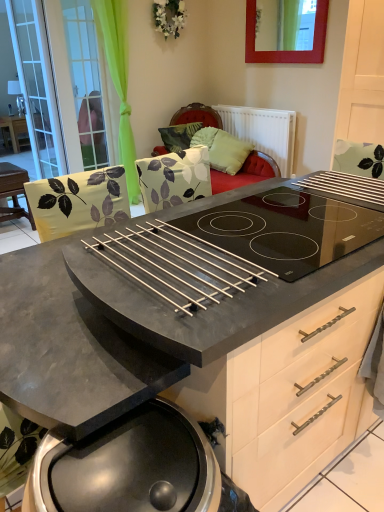
In order to click on matte black table at left, the first table from the back in this screenshot , I will do `click(14, 130)`.

In order to face metallic matte barbecue grill at lower center, should I rotate leftwards or rightwards?

Turn left approximately 5.313 degrees to face it.

The height and width of the screenshot is (512, 384). I want to click on green leaf-patterned pillow at upper center, the second pillow in the right-to-left sequence, so click(x=179, y=136).

Describe the element at coordinates (179, 136) in the screenshot. This screenshot has width=384, height=512. I see `green leaf-patterned pillow at upper center, which is counted as the 1th pillow, starting from the left` at that location.

How much space does green fabric screen door at upper left, the second screen door in the left-to-right sequence, occupy horizontally?

green fabric screen door at upper left, the second screen door in the left-to-right sequence, is 3.84 inches wide.

Measure the distance between red wood picture frame at upper center and camera.

The distance of red wood picture frame at upper center from camera is 3.37 meters.

Find the location of a particular element. This screenshot has width=384, height=512. white matte radiator at upper center is located at coordinates (263, 131).

Where is `matte black table at left, which is the first table in right-to-left order`? The image size is (384, 512). matte black table at left, which is the first table in right-to-left order is located at coordinates (14, 192).

Locate an element on the screen. green fabric pillow at center, positioned as the 1th pillow in right-to-left order is located at coordinates (228, 152).

You are a GUI agent. You are given a task and a screenshot of the screen. Output one action in this format:
    pyautogui.click(x=<x>, y=<y>)
    Task: Click on the matte black table at left, which is counted as the second table, starting from the right
    This screenshot has height=512, width=384.
    Given the screenshot: What is the action you would take?
    pyautogui.click(x=14, y=130)

Is matte black table at left, which is the first table in right-to-left order, inside or outside of white matte radiator at upper center?

matte black table at left, which is the first table in right-to-left order, is outside white matte radiator at upper center.

Between matte black table at left, the 2th table from the left, and white matte radiator at upper center, which one appears on the left side from the viewer's perspective?

matte black table at left, the 2th table from the left, is more to the left.

Locate an element on the screen. This screenshot has height=512, width=384. radiator on the right of matte black table at left, marked as the 2th table in a back-to-front arrangement is located at coordinates (263, 131).

From the image's perspective, is matte black table at left, the 1th table viewed from the front, under white matte radiator at upper center?

Yes, from the image's perspective, matte black table at left, the 1th table viewed from the front, is beneath white matte radiator at upper center.

Which of these two, green fabric screen door at upper left, the second screen door in the left-to-right sequence, or transparent glass screen door at left, which is the second screen door in right-to-left order, is bigger?

Bigger between the two is transparent glass screen door at left, which is the second screen door in right-to-left order.

From the image's perspective, which is below, green fabric screen door at upper left, which is counted as the 1th screen door, starting from the right, or transparent glass screen door at left, placed as the 1th screen door when sorted from left to right?

From the image's view, transparent glass screen door at left, placed as the 1th screen door when sorted from left to right, is below.

Does point (96, 146) lie in front of point (26, 60)?

That is False.

Would you say green fabric screen door at upper left, the second screen door in the left-to-right sequence, is inside or outside transparent glass screen door at left, placed as the 1th screen door when sorted from left to right?

green fabric screen door at upper left, the second screen door in the left-to-right sequence, is not enclosed by transparent glass screen door at left, placed as the 1th screen door when sorted from left to right.

From the image's perspective, between transparent glass screen door at left, which is the second screen door in right-to-left order, and matte black table at left, which is the first table in right-to-left order, who is located below?

matte black table at left, which is the first table in right-to-left order.

From the matte black table at left, which is the first table in right-to-left order, count 1st screen door to the right and point to it. Please provide its 2D coordinates.

[(37, 85)]

Considering the sizes of objects transparent glass screen door at left, placed as the 1th screen door when sorted from left to right, and matte black table at left, the 1th table viewed from the front, in the image provided, who is shorter, transparent glass screen door at left, placed as the 1th screen door when sorted from left to right, or matte black table at left, the 1th table viewed from the front,?

Standing shorter between the two is matte black table at left, the 1th table viewed from the front.

This screenshot has height=512, width=384. What are the coordinates of `screen door that is the 1st object to the left of the red wood picture frame at upper center, starting at the anchor` in the screenshot? It's located at (81, 81).

Can we say red wood picture frame at upper center lies outside green fabric screen door at upper left, which is counted as the 1th screen door, starting from the right?

That's correct, red wood picture frame at upper center is outside of green fabric screen door at upper left, which is counted as the 1th screen door, starting from the right.

Would you say red wood picture frame at upper center is a long distance from green fabric screen door at upper left, which is counted as the 1th screen door, starting from the right?

red wood picture frame at upper center is positioned a significant distance from green fabric screen door at upper left, which is counted as the 1th screen door, starting from the right.

In the scene shown: Between red wood picture frame at upper center and green fabric screen door at upper left, which is counted as the 1th screen door, starting from the right, which one is positioned in front?

red wood picture frame at upper center is closer to the camera.

From the picture: Is transparent glass screen door at left, which is the second screen door in right-to-left order, facing away from green leaf-patterned pillow at upper center, which is counted as the 1th pillow, starting from the left?

No, transparent glass screen door at left, which is the second screen door in right-to-left order,'s orientation is not away from green leaf-patterned pillow at upper center, which is counted as the 1th pillow, starting from the left.

Is green leaf-patterned pillow at upper center, which is counted as the 1th pillow, starting from the left, inside transparent glass screen door at left, placed as the 1th screen door when sorted from left to right?

No.

Does transparent glass screen door at left, placed as the 1th screen door when sorted from left to right, touch green leaf-patterned pillow at upper center, which is counted as the 1th pillow, starting from the left?

transparent glass screen door at left, placed as the 1th screen door when sorted from left to right, and green leaf-patterned pillow at upper center, which is counted as the 1th pillow, starting from the left, are clearly separated.

How many degrees apart are the facing directions of transparent glass screen door at left, placed as the 1th screen door when sorted from left to right, and green leaf-patterned pillow at upper center, the second pillow in the right-to-left sequence?

transparent glass screen door at left, placed as the 1th screen door when sorted from left to right, and green leaf-patterned pillow at upper center, the second pillow in the right-to-left sequence, are facing 73.7 degrees away from each other.

From the image's perspective, between metallic matte barbecue grill at lower center and matte black table at left, which is the 1th table in bottom-to-top order, who is located below?

From the image's view, metallic matte barbecue grill at lower center is below.

Considering the relative sizes of metallic matte barbecue grill at lower center and matte black table at left, which is the 1th table in bottom-to-top order, in the image provided, is metallic matte barbecue grill at lower center smaller than matte black table at left, which is the 1th table in bottom-to-top order,?

Indeed, metallic matte barbecue grill at lower center has a smaller size compared to matte black table at left, which is the 1th table in bottom-to-top order.

Consider the image. Is metallic matte barbecue grill at lower center looking in the opposite direction of matte black table at left, the 2th table from the left?

Yes, metallic matte barbecue grill at lower center is facing away from matte black table at left, the 2th table from the left.

Do you think metallic matte barbecue grill at lower center is within matte black table at left, the 1th table viewed from the front, or outside of it?

metallic matte barbecue grill at lower center is not enclosed by matte black table at left, the 1th table viewed from the front.

From the image's perspective, relative to matte black table at left, marked as the 2th table in a back-to-front arrangement, is green fabric screen door at upper left, the second screen door in the left-to-right sequence, above or below?

From the image's perspective, green fabric screen door at upper left, the second screen door in the left-to-right sequence, appears above matte black table at left, marked as the 2th table in a back-to-front arrangement.

Is green fabric screen door at upper left, the second screen door in the left-to-right sequence, wider or thinner than matte black table at left, the second table in the top-to-bottom sequence?

Considering their sizes, green fabric screen door at upper left, the second screen door in the left-to-right sequence, looks slimmer than matte black table at left, the second table in the top-to-bottom sequence.

Locate an element on the screen. the 1st table to the left when counting from the green fabric screen door at upper left, the second screen door in the left-to-right sequence is located at coordinates (14, 192).

From a real-world perspective, between green fabric screen door at upper left, the second screen door in the left-to-right sequence, and matte black table at left, the 2th table from the left, who is vertically lower?

From a 3D spatial view, matte black table at left, the 2th table from the left, is below.

Identify the location of the 1st table counting from the left of the white matte radiator at upper center. This screenshot has width=384, height=512. point(14,192).

Locate an element on the screen. screen door lying above the transparent glass screen door at left, which is the second screen door in right-to-left order (from the image's perspective) is located at coordinates (81, 81).

Estimate the real-world distances between objects in this image. Which object is further from transparent glass screen door at left, which is the second screen door in right-to-left order, metallic matte barbecue grill at lower center or matte black table at left, the first table from the back?

metallic matte barbecue grill at lower center is further to transparent glass screen door at left, which is the second screen door in right-to-left order.

Consider the image. Which object lies further to the anchor point matte black table at left, acting as the second table starting from the front, green fabric screen door at upper left, which is counted as the 1th screen door, starting from the right, or green fabric pillow at center, the 2th pillow viewed from the left?

green fabric pillow at center, the 2th pillow viewed from the left.

Considering their positions, is green fabric screen door at upper left, the second screen door in the left-to-right sequence, positioned closer to red wood picture frame at upper center than white matte radiator at upper center?

white matte radiator at upper center is closer to red wood picture frame at upper center.

Considering their positions, is matte black table at left, the 2th table from the left, positioned closer to transparent glass screen door at left, which is the second screen door in right-to-left order, than green fabric screen door at upper left, which is counted as the 1th screen door, starting from the right?

green fabric screen door at upper left, which is counted as the 1th screen door, starting from the right.

Considering their positions, is matte black table at left, the 2th table from the left, positioned closer to green fabric screen door at upper left, the second screen door in the left-to-right sequence, than transparent glass screen door at left, which is the second screen door in right-to-left order?

transparent glass screen door at left, which is the second screen door in right-to-left order, is closer to green fabric screen door at upper left, the second screen door in the left-to-right sequence.

When comparing their distances from green fabric screen door at upper left, which is counted as the 1th screen door, starting from the right, does transparent glass screen door at left, placed as the 1th screen door when sorted from left to right, or matte black table at left, the 2th table from the left, seem further?

The object further to green fabric screen door at upper left, which is counted as the 1th screen door, starting from the right, is matte black table at left, the 2th table from the left.

Which object lies nearer to the anchor point transparent glass screen door at left, which is the second screen door in right-to-left order, white matte radiator at upper center or matte black table at left, which is the first table in right-to-left order?

matte black table at left, which is the first table in right-to-left order.

Based on their spatial positions, is green leaf-patterned pillow at upper center, which is counted as the 1th pillow, starting from the left, or metallic matte barbecue grill at lower center further from green fabric screen door at upper left, which is counted as the 1th screen door, starting from the right?

metallic matte barbecue grill at lower center.

Identify the location of screen door between transparent glass screen door at left, which is the second screen door in right-to-left order, and white matte radiator at upper center from left to right. (81, 81).

Where is `screen door located between transparent glass screen door at left, placed as the 1th screen door when sorted from left to right, and red wood picture frame at upper center in the left-right direction`? screen door located between transparent glass screen door at left, placed as the 1th screen door when sorted from left to right, and red wood picture frame at upper center in the left-right direction is located at coordinates (81, 81).

You are a GUI agent. You are given a task and a screenshot of the screen. Output one action in this format:
    pyautogui.click(x=<x>, y=<y>)
    Task: Click on the pillow between matte black table at left, the first table from the back, and green fabric pillow at center, positioned as the 1th pillow in right-to-left order, from left to right
    Image resolution: width=384 pixels, height=512 pixels.
    Given the screenshot: What is the action you would take?
    (179, 136)

This screenshot has height=512, width=384. Identify the location of picture frame between metallic matte barbecue grill at lower center and matte black table at left, acting as the first table starting from the top, from front to back. (286, 31).